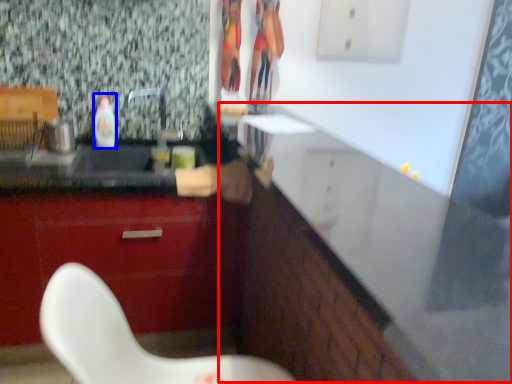
Question: Which of the following is the closest to the observer, counter (highlighted by a red box) or bottle (highlighted by a blue box)?

Choices:
 (A) counter
 (B) bottle

Answer: (A)